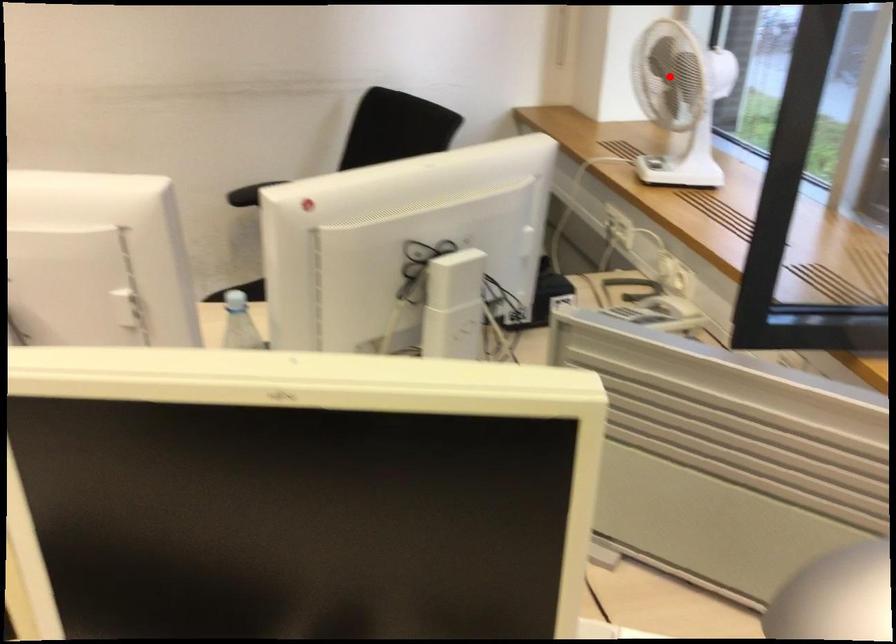
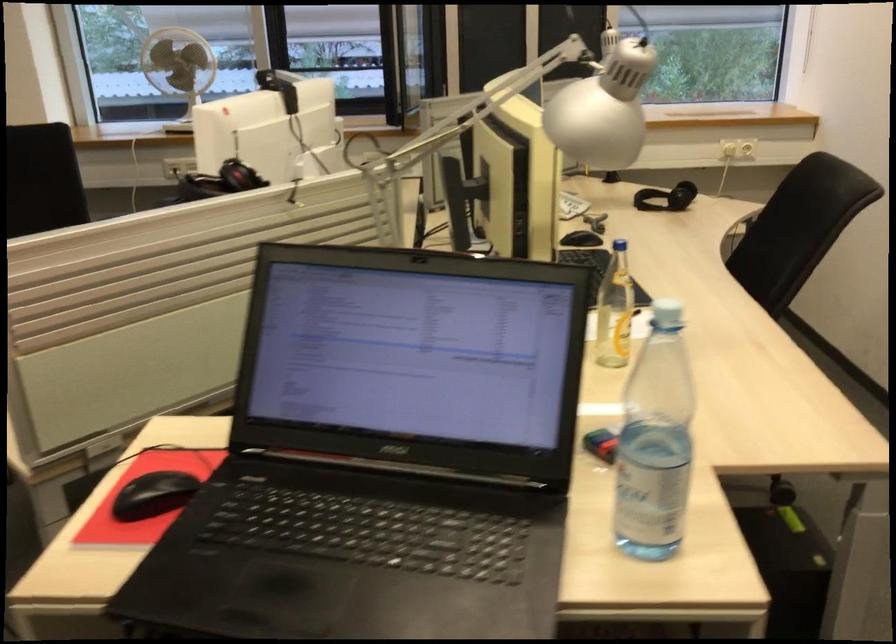
Question: A red point is marked in image1. In image2, is the corresponding 3D point closer to the camera or farther? Reply with the corresponding letter.

Choices:
 (A) The corresponding 3D point is closer.
 (B) The corresponding 3D point is farther.

Answer: (B)